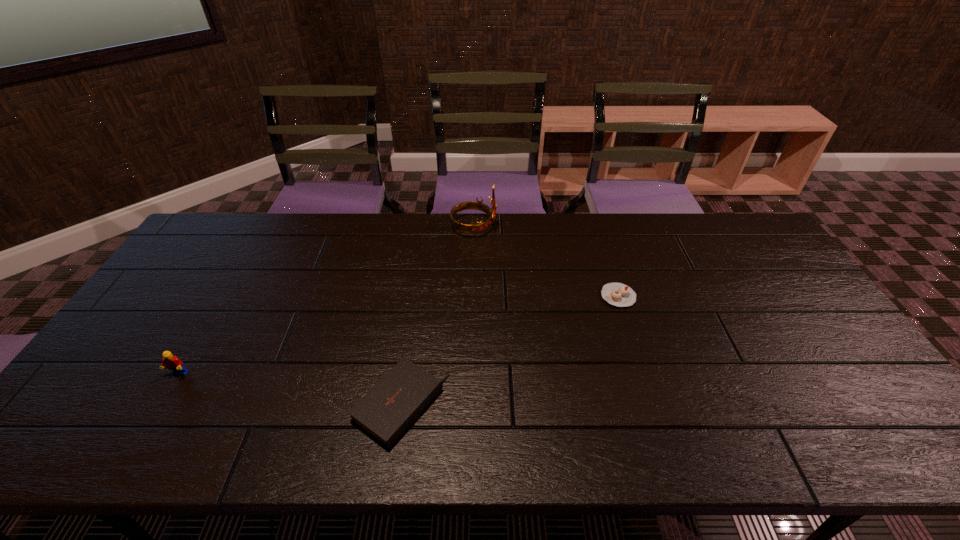
You are a GUI agent. You are given a task and a screenshot of the screen. Output one action in this format:
    pyautogui.click(x=<x>, y=<y>)
    Task: Click on the vacant space situated 0.270m on the right of the Bible
    
    Given the screenshot: What is the action you would take?
    pyautogui.click(x=561, y=405)

Locate an element on the screen. object located at the far edge is located at coordinates (480, 226).

You are a GUI agent. You are given a task and a screenshot of the screen. Output one action in this format:
    pyautogui.click(x=<x>, y=<y>)
    Task: Click on the object that is at the near edge
    The image size is (960, 540).
    Given the screenshot: What is the action you would take?
    pyautogui.click(x=385, y=412)

The image size is (960, 540). In the image, there is a desktop. In order to click on blank space at the far edge in this screenshot , I will do `click(710, 245)`.

This screenshot has width=960, height=540. In the image, there is a desktop. In order to click on free space at the near edge in this screenshot , I will do `click(692, 434)`.

Where is `free space at the left edge`? free space at the left edge is located at coordinates click(166, 329).

You are a GUI agent. You are given a task and a screenshot of the screen. Output one action in this format:
    pyautogui.click(x=<x>, y=<y>)
    Task: Click on the free region at the right edge of the desktop
    The image size is (960, 540).
    Given the screenshot: What is the action you would take?
    pyautogui.click(x=768, y=319)

This screenshot has height=540, width=960. What are the coordinates of `blank space at the far left corner` in the screenshot? It's located at (249, 234).

Image resolution: width=960 pixels, height=540 pixels. What are the coordinates of `vacant space at the far right corner of the desktop` in the screenshot? It's located at (733, 225).

The image size is (960, 540). I want to click on vacant space at the near right corner, so click(x=852, y=421).